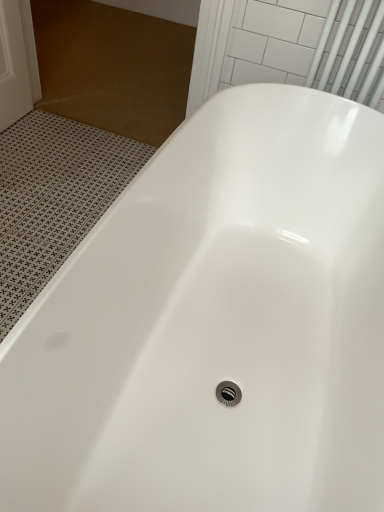
Find the location of a particular element. This screenshot has width=384, height=512. white glossy towel bar at upper right is located at coordinates (352, 52).

What do you see at coordinates (352, 52) in the screenshot? The height and width of the screenshot is (512, 384). I see `white glossy towel bar at upper right` at bounding box center [352, 52].

At what (x,y) coordinates should I click in order to perform the action: click on white glossy towel bar at upper right. Please return your answer as a coordinate pair (x, y). The height and width of the screenshot is (512, 384). Looking at the image, I should click on (352, 52).